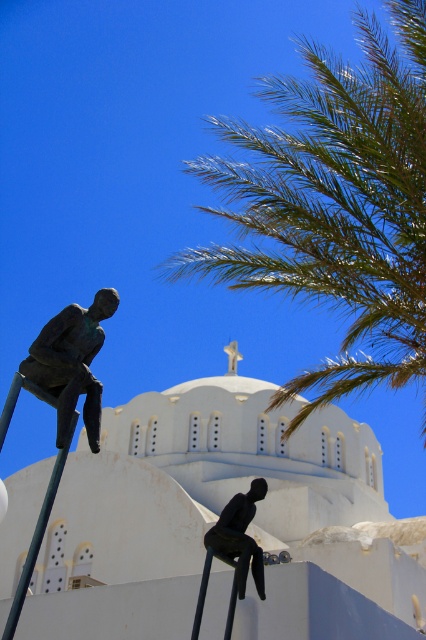
Question: Is bronze statue at center closer to the viewer compared to green metallic pole at lower left?

Choices:
 (A) yes
 (B) no

Answer: (B)

Question: Which of these objects is positioned closest to the green leafy palm at upper right?

Choices:
 (A) bronze statue at center
 (B) green metallic pole at lower left

Answer: (B)

Question: Which point appears farthest from the camera in this image?

Choices:
 (A) (51, 472)
 (B) (241, 596)
 (C) (74, 316)
 (D) (161, 435)

Answer: (D)

Question: Is white smooth church at center positioned in front of green leafy palm at upper right?

Choices:
 (A) yes
 (B) no

Answer: (A)

Question: Among these objects, which one is nearest to the camera?

Choices:
 (A) bronze statue at center
 (B) bronze statue at left
 (C) green metallic pole at lower left

Answer: (C)

Question: Is the position of white smooth church at center more distant than that of bronze statue at center?

Choices:
 (A) no
 (B) yes

Answer: (B)